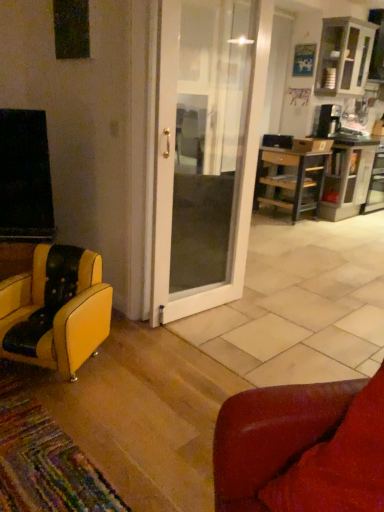
Where is `white glossy cabinet at upper right`? This screenshot has width=384, height=512. white glossy cabinet at upper right is located at coordinates (344, 56).

At what (x,y) coordinates should I click in order to perform the action: click on white glossy cabinet at upper right. Please return your answer as a coordinate pair (x, y). This screenshot has height=512, width=384. Looking at the image, I should click on (344, 56).

Are wooden cabinet at right and leather couch at lower right, the second chair viewed from the back, making contact?

No, wooden cabinet at right is not beside leather couch at lower right, the second chair viewed from the back.

Does wooden cabinet at right appear on the left side of leather couch at lower right, the second chair viewed from the back?

Incorrect, wooden cabinet at right is not on the left side of leather couch at lower right, the second chair viewed from the back.

From a real-world perspective, which object stands above the other?

In real-world perspective, leather couch at lower right, which is counted as the second chair, starting from the left, is above.

Which of these two, wooden cabinet at right or leather couch at lower right, positioned as the 1th chair in right-to-left order, is bigger?

wooden cabinet at right is bigger.

How distant is yellow leather chair at lower left, which is counted as the first chair, starting from the back, from white glossy cabinet at upper right?

The distance of yellow leather chair at lower left, which is counted as the first chair, starting from the back, from white glossy cabinet at upper right is 5.25 meters.

Does yellow leather chair at lower left, the 2th chair from the right, have a larger size compared to white glossy cabinet at upper right?

Incorrect, yellow leather chair at lower left, the 2th chair from the right, is not larger than white glossy cabinet at upper right.

From the picture: Visually, is yellow leather chair at lower left, the 2th chair from the right, positioned to the left or to the right of white glossy cabinet at upper right?

yellow leather chair at lower left, the 2th chair from the right, is positioned on white glossy cabinet at upper right's left side.

Is yellow leather chair at lower left, the 2th chair from the right, situated inside white glossy cabinet at upper right or outside?

yellow leather chair at lower left, the 2th chair from the right, is outside white glossy cabinet at upper right.

Is point (354, 191) positioned after point (320, 142)?

Yes, point (354, 191) is behind point (320, 142).

Considering the positions of objects wooden cabinet at right and wooden desk at right in the image provided, who is more to the right, wooden cabinet at right or wooden desk at right?

Positioned to the right is wooden cabinet at right.

Is wooden cabinet at right next to wooden desk at right and touching it?

wooden cabinet at right and wooden desk at right are clearly separated.

Measure the distance from wooden cabinet at right to wooden desk at right.

wooden cabinet at right and wooden desk at right are 18.88 inches apart from each other.

Considering the relative sizes of leather couch at lower right, positioned as the 1th chair in right-to-left order, and wooden cabinet at right in the image provided, is leather couch at lower right, positioned as the 1th chair in right-to-left order, thinner than wooden cabinet at right?

Correct, the width of leather couch at lower right, positioned as the 1th chair in right-to-left order, is less than that of wooden cabinet at right.

Is leather couch at lower right, which is counted as the second chair, starting from the left, turned away from wooden cabinet at right?

No, leather couch at lower right, which is counted as the second chair, starting from the left,'s orientation is not away from wooden cabinet at right.

Which is more to the left, leather couch at lower right, positioned as the 1th chair in right-to-left order, or wooden cabinet at right?

From the viewer's perspective, leather couch at lower right, positioned as the 1th chair in right-to-left order, appears more on the left side.

From the image's perspective, is wooden cabinet at right on top of yellow leather chair at lower left, which is the 2th chair from front to back?

Yes, from the image's perspective, wooden cabinet at right is on top of yellow leather chair at lower left, which is the 2th chair from front to back.

From a real-world perspective, is wooden cabinet at right on top of yellow leather chair at lower left, the 1th chair when ordered from left to right?

Yes, from a real-world perspective, wooden cabinet at right is on top of yellow leather chair at lower left, the 1th chair when ordered from left to right.

Is wooden cabinet at right further to the viewer compared to yellow leather chair at lower left, which is counted as the first chair, starting from the back?

Yes, wooden cabinet at right is behind yellow leather chair at lower left, which is counted as the first chair, starting from the back.

Measure the distance from wooden cabinet at right to yellow leather chair at lower left, which is counted as the first chair, starting from the back.

wooden cabinet at right and yellow leather chair at lower left, which is counted as the first chair, starting from the back, are 4.16 meters apart.

In terms of size, does wooden desk at right appear bigger or smaller than leather couch at lower right, positioned as the 1th chair in right-to-left order?

In the image, wooden desk at right appears to be larger than leather couch at lower right, positioned as the 1th chair in right-to-left order.

From the image's perspective, which is above, wooden desk at right or leather couch at lower right, marked as the first chair in a front-to-back arrangement?

wooden desk at right.

Is wooden desk at right positioned far away from leather couch at lower right, which is counted as the second chair, starting from the left?

Absolutely, wooden desk at right is distant from leather couch at lower right, which is counted as the second chair, starting from the left.

Is wooden desk at right completely or partially outside of leather couch at lower right, marked as the first chair in a front-to-back arrangement?

Yes, wooden desk at right is not within leather couch at lower right, marked as the first chair in a front-to-back arrangement.

From the image's perspective, is wooden desk at right under white glossy cabinet at upper right?

Yes, from the image's perspective, wooden desk at right is below white glossy cabinet at upper right.

Could white glossy cabinet at upper right be considered to be inside wooden desk at right?

No, white glossy cabinet at upper right is not a part of wooden desk at right.

From a real-world perspective, is wooden desk at right on top of white glossy cabinet at upper right?

Actually, wooden desk at right is physically below white glossy cabinet at upper right in the real world.

Image resolution: width=384 pixels, height=512 pixels. Identify the location of shelf below the leather couch at lower right, the second chair viewed from the back (from a real-world perspective). (347, 178).

From the white glossy cabinet at upper right, count the 2nd chair to the left and point to it. Please provide its 2D coordinates.

[(56, 310)]

In the scene shown: Based on their spatial positions, is yellow leather chair at lower left, which is counted as the first chair, starting from the back, or leather couch at lower right, the second chair viewed from the back, further from wooden cabinet at right?

leather couch at lower right, the second chair viewed from the back, is further to wooden cabinet at right.

Which object lies nearer to the anchor point wooden cabinet at right, wooden desk at right or yellow leather chair at lower left, the 2th chair from the right?

wooden desk at right is closer to wooden cabinet at right.

From the image, which object appears to be farther from wooden desk at right, white glossy cabinet at upper right or wooden cabinet at right?

Based on the image, white glossy cabinet at upper right appears to be further to wooden desk at right.

When comparing their distances from wooden desk at right, does wooden cabinet at right or leather couch at lower right, the second chair viewed from the back, seem closer?

wooden cabinet at right lies closer to wooden desk at right than the other object.

From the image, which object appears to be nearer to yellow leather chair at lower left, which is the 2th chair from front to back, wooden cabinet at right or wooden desk at right?

wooden desk at right is positioned closer to the anchor yellow leather chair at lower left, which is the 2th chair from front to back.

Which object lies further to the anchor point yellow leather chair at lower left, which is the 2th chair from front to back, leather couch at lower right, the second chair viewed from the back, or wooden desk at right?

The object further to yellow leather chair at lower left, which is the 2th chair from front to back, is wooden desk at right.

Estimate the real-world distances between objects in this image. Which object is closer to yellow leather chair at lower left, the 1th chair when ordered from left to right, wooden desk at right or wooden cabinet at right?

wooden desk at right.

When comparing their distances from yellow leather chair at lower left, the 1th chair when ordered from left to right, does wooden desk at right or leather couch at lower right, which is counted as the second chair, starting from the left, seem closer?

leather couch at lower right, which is counted as the second chair, starting from the left, is positioned closer to the anchor yellow leather chair at lower left, the 1th chair when ordered from left to right.

You are a GUI agent. You are given a task and a screenshot of the screen. Output one action in this format:
    pyautogui.click(x=<x>, y=<y>)
    Task: Click on the chair positioned between leather couch at lower right, positioned as the 1th chair in right-to-left order, and white glossy cabinet at upper right from near to far
    The width and height of the screenshot is (384, 512).
    Given the screenshot: What is the action you would take?
    pyautogui.click(x=56, y=310)

I want to click on shelf between white glossy cabinet at upper right and wooden desk at right in the vertical direction, so click(x=347, y=178).

Where is `desk between leather couch at lower right, positioned as the 1th chair in right-to-left order, and wooden cabinet at right in the front-back direction`? This screenshot has width=384, height=512. desk between leather couch at lower right, positioned as the 1th chair in right-to-left order, and wooden cabinet at right in the front-back direction is located at coordinates (x=292, y=176).

Where is `cabinetry between leather couch at lower right, which is counted as the second chair, starting from the left, and wooden cabinet at right in the front-back direction`? cabinetry between leather couch at lower right, which is counted as the second chair, starting from the left, and wooden cabinet at right in the front-back direction is located at coordinates (344, 56).